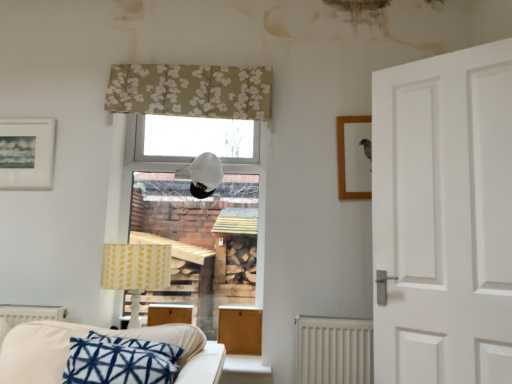
Question: Is white matte radiator at lower left, positioned as the second radiator in right-to-left order, bigger or smaller than white fabric couch at lower left?

Choices:
 (A) small
 (B) big

Answer: (A)

Question: Is white matte radiator at lower left, positioned as the second radiator in right-to-left order, taller or shorter than white fabric couch at lower left?

Choices:
 (A) short
 (B) tall

Answer: (A)

Question: Which of these objects is positioned farthest from the beige floral fabric at upper center?

Choices:
 (A) white textured radiator at lower center, which appears as the 1th radiator when viewed from the right
 (B) white matte radiator at lower left, positioned as the second radiator in right-to-left order
 (C) wooden box at center
 (D) white matte table lamp at center, marked as the 1th table lamp in a top-to-bottom arrangement
 (E) wooden picture frame at upper right, which is the 1th picture frame from right to left

Answer: (B)

Question: Based on their relative distances, which object is farther from the white textured radiator at lower center, which appears as the 1th radiator when viewed from the right?

Choices:
 (A) beige floral fabric at upper center
 (B) white matte table lamp at center, the second table lamp in the bottom-to-top sequence
 (C) white matte radiator at lower left, which is counted as the first radiator, starting from the left
 (D) yellow fabric lampshade at lower left, marked as the 1th table lamp in a left-to-right arrangement
 (E) wooden box at center

Answer: (C)